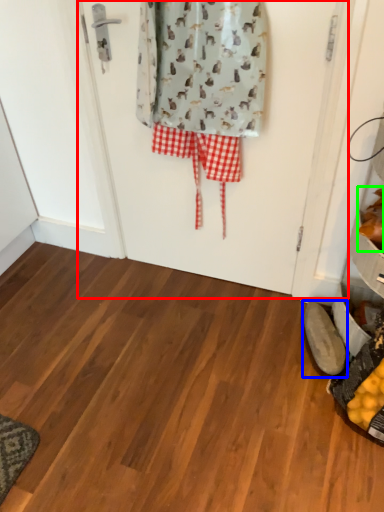
Question: Based on their relative distances, which object is farther from screen door (highlighted by a red box)? Choose from footwear (highlighted by a blue box) and food (highlighted by a green box).

Choices:
 (A) footwear
 (B) food

Answer: (A)